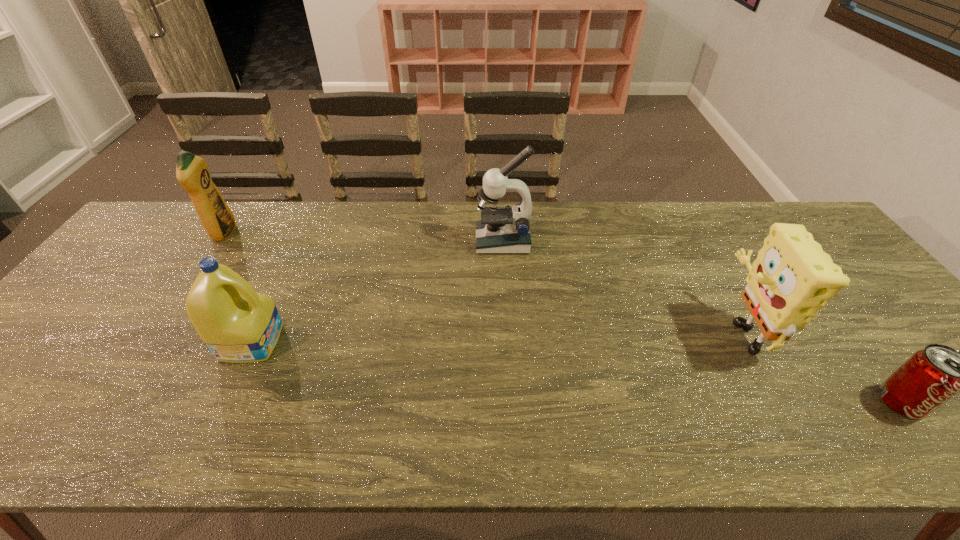
Find the location of a particular element. This screenshot has height=540, width=960. free space between the third object from right to left and the leftmost object is located at coordinates (364, 237).

Find the location of `vacant region between the sponge and the pop soda`. vacant region between the sponge and the pop soda is located at coordinates (820, 366).

You are a GUI agent. You are given a task and a screenshot of the screen. Output one action in this format:
    pyautogui.click(x=<x>, y=<y>)
    Task: Click on the free space that is in between the sponge and the pop soda
    
    Given the screenshot: What is the action you would take?
    pyautogui.click(x=820, y=366)

Select which object appears as the fourth closest to the rightmost object. Please provide its 2D coordinates. Your answer should be formatted as a tuple, i.e. [(x, y)], where the tuple contains the x and y coordinates of a point satisfying the conditions above.

[(192, 172)]

At what (x,y) coordinates should I click in order to perform the action: click on object that is the fourth nearest to the microscope. Please return your answer as a coordinate pair (x, y). Looking at the image, I should click on (930, 377).

Where is `vacant region that satisfies the following two spatial constraints: 1. on the face of the sponge; 2. on the right side of the shortest object`? vacant region that satisfies the following two spatial constraints: 1. on the face of the sponge; 2. on the right side of the shortest object is located at coordinates (778, 402).

Image resolution: width=960 pixels, height=540 pixels. In order to click on vacant space that satisfies the following two spatial constraints: 1. on the label of the third object from right to left; 2. on the left side of the left detergent in this screenshot , I will do `click(219, 241)`.

Locate an element on the screen. This screenshot has width=960, height=540. vacant point that satisfies the following two spatial constraints: 1. on the label of the left detergent; 2. on the left side of the third object from left to right is located at coordinates (219, 241).

Identify the location of free spot that satisfies the following two spatial constraints: 1. on the label of the left detergent; 2. on the left side of the third object from left to right. This screenshot has height=540, width=960. (219, 241).

Find the location of a particular element. This screenshot has height=540, width=960. vacant space that satisfies the following two spatial constraints: 1. on the back side of the rightmost object; 2. on the label of the nearer detergent is located at coordinates (854, 341).